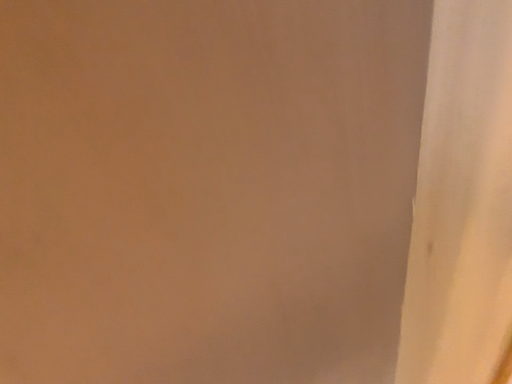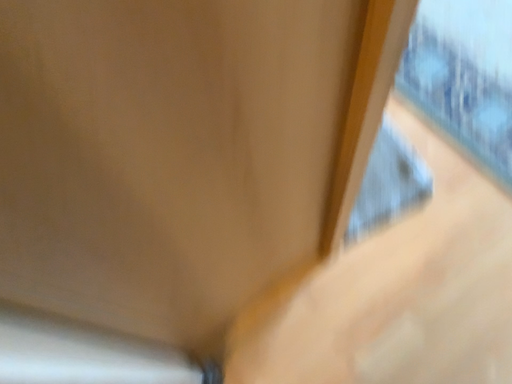
Question: How did the camera likely rotate when shooting the video?

Choices:
 (A) rotated upward
 (B) rotated downward

Answer: (B)